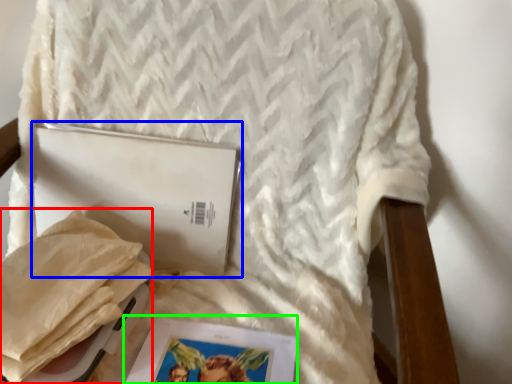
Question: Which object is positioned closest to material (highlighted by a red box)? Select from journal (highlighted by a blue box) and magazine (highlighted by a green box).

Choices:
 (A) journal
 (B) magazine

Answer: (A)